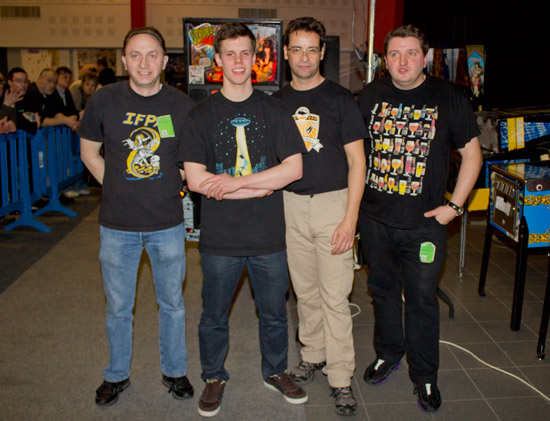
You are a GUI agent. You are given a task and a screenshot of the screen. Output one action in this format:
    pyautogui.click(x=<x>, y=<y>)
    Task: Click on the tile floor
    
    Given the screenshot: What is the action you would take?
    pyautogui.click(x=481, y=399)